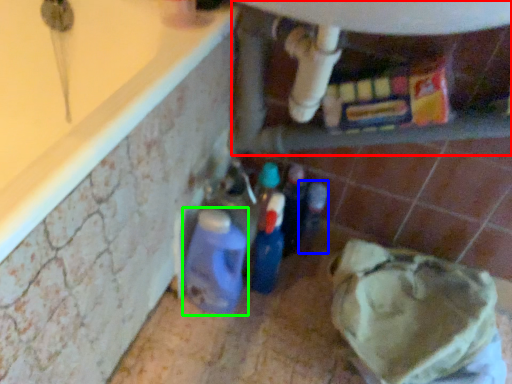
Question: Which is nearer to the water heater (highlighted by a red box)? bottle (highlighted by a blue box) or bottle (highlighted by a green box).

Choices:
 (A) bottle
 (B) bottle

Answer: (A)